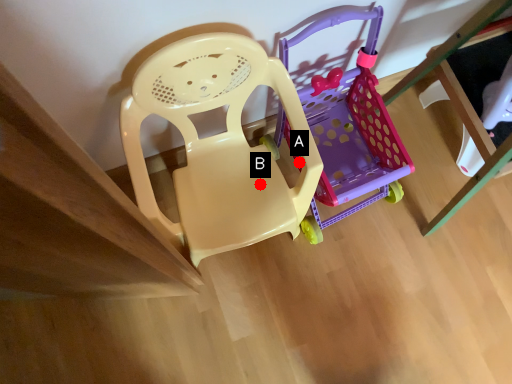
Question: Two points are circled on the image, labeled by A and B beside each circle. Among these points, which one is farthest from the camera?

Choices:
 (A) A is further
 (B) B is further

Answer: (B)